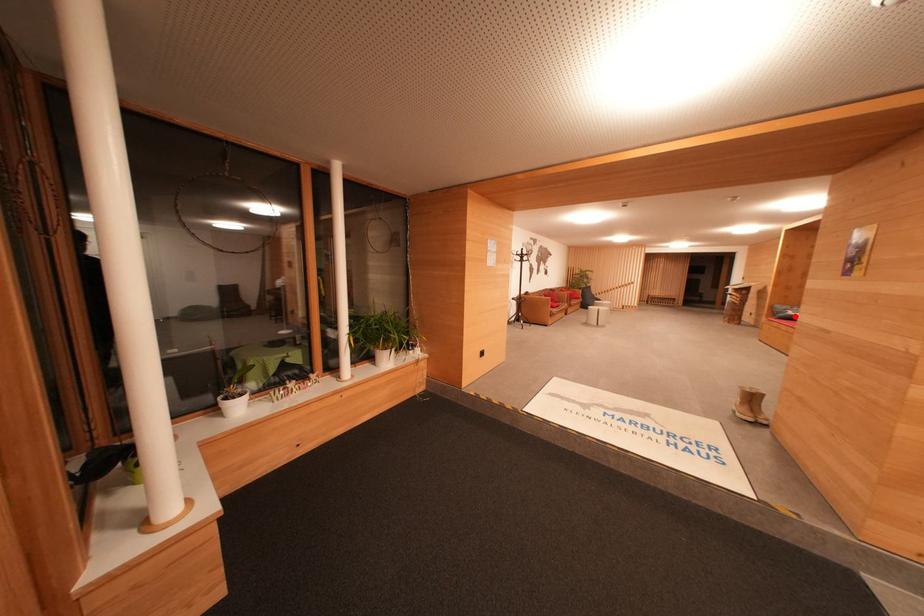
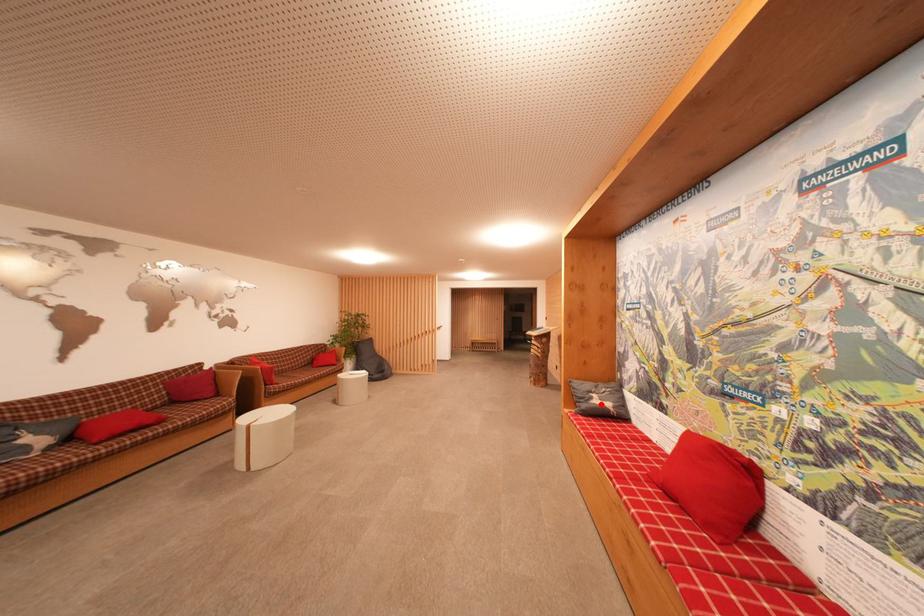
I am providing you with two images of the same scene from different viewpoints. A red point is marked on the first image and another point is marked on the second image. Is the marked point in image1 the same physical position as the marked point in image2?

Yes